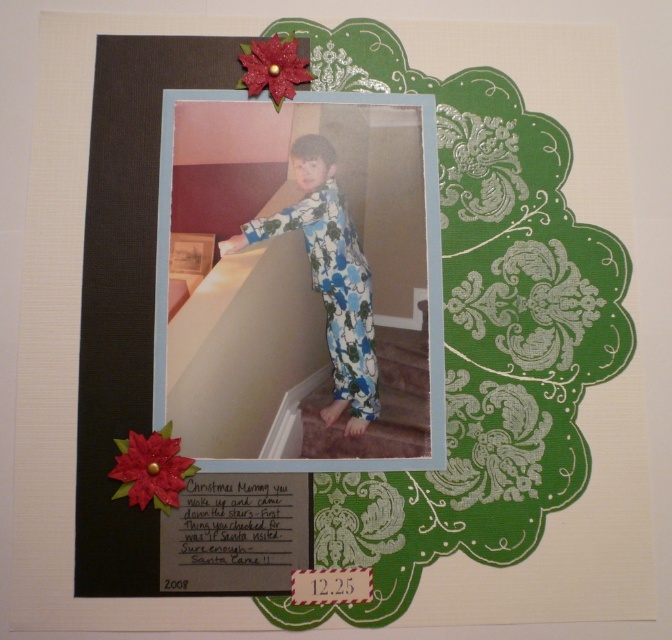
Does floral pajamas at center appear over glittery red flower at upper left?

Yes.

Which is more to the left, floral pajamas at center or glittery red flower at upper left?

Positioned to the left is glittery red flower at upper left.

Between point (300, 172) and point (116, 472), which one is positioned behind?

The point (300, 172) is behind.

What are the coordinates of `floral pajamas at center` in the screenshot? It's located at 329,276.

Between carpeted stairs at center and glittery red flower at upper left, which one has more height?

carpeted stairs at center is taller.

Does carpeted stairs at center have a lesser height compared to glittery red flower at upper left?

Incorrect, carpeted stairs at center's height does not fall short of glittery red flower at upper left's.

Where is `carpeted stairs at center`? The height and width of the screenshot is (640, 672). carpeted stairs at center is located at coordinates (378, 404).

Image resolution: width=672 pixels, height=640 pixels. I want to click on carpeted stairs at center, so click(378, 404).

Can you confirm if floral pajamas at center is smaller than carpeted stairs at center?

Incorrect, floral pajamas at center is not smaller in size than carpeted stairs at center.

Measure the distance between floral pajamas at center and camera.

floral pajamas at center is 34.52 inches away from camera.

Where is `floral pajamas at center`? floral pajamas at center is located at coordinates (329, 276).